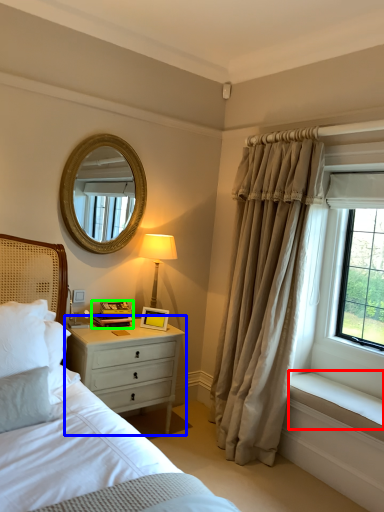
Question: Which object is the farthest from window sill (highlighted by a red box)? Choose among these: nightstand (highlighted by a blue box) or book (highlighted by a green box).

Choices:
 (A) nightstand
 (B) book

Answer: (B)